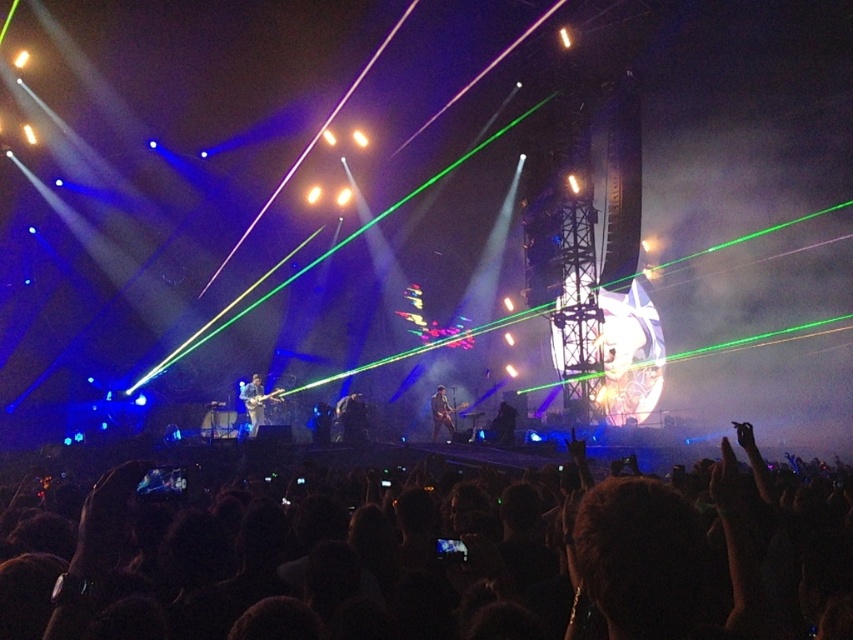
You are a photographer at the concert and want to capture a shot that includes both the shiny silver guitar at center and the black fabric at center. Based on their positions, which object should you place on the left side of your photo to ensure both are in frame?

The shiny silver guitar at center should be placed on the left side of your photo since it is positioned on the left side of the black fabric at center, ensuring both objects are included in the frame.

You are a photographer at the concert and want to capture the guitar at center. You notice a point with coordinates (440, 413) in your camera viewfinder. Where is this point located?

The point at coordinates (440, 413) is located on the shiny black guitar at center.

You are a stagehand who needs to position a 10 feet long ladder to reach the large screen on the right side of the stage. The shiny silver guitar at center and the black fabric at center are in your way. Can you fit the ladder between them?

The shiny silver guitar at center is 130.14 feet from the black fabric at center, so yes, the ladder can fit between them since the distance between the two objects is much larger than the ladder length.